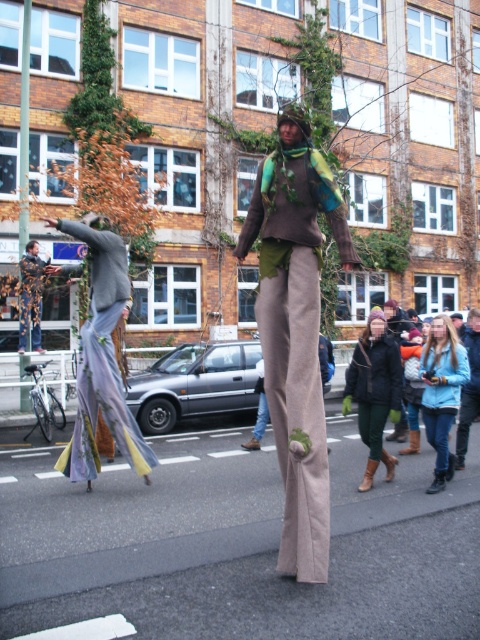
You are a photographer trying to capture both the blue denim jacket at lower right and the camouflage fabric man at left in a single frame. Based on their sizes, which object should you focus on first to ensure both fit in the shot?

The blue denim jacket at lower right has a lesser width compared to the camouflage fabric man at left, so you should focus on the camouflage fabric man at left first to ensure both fit in the shot since it is wider and requires more space.

You are a photographer trying to capture the dark brown leather boots at center and the matte brown pants at center in a single photo. Since both are in the center, will the boots be visible in the photo?

The dark brown leather boots at center is positioned over matte brown pants at center, so yes, the boots will be visible in the photo as they are layered on top of the pants.

You are a photographer trying to capture a photo of the dark brown leather boots at center and matte brown pants at center in the same frame. Based on their positions, which object should you focus on first to ensure both are in the shot?

Since the dark brown leather boots at center are to the left of matte brown pants at center, you should focus on the dark brown leather boots at center first to ensure both are in the shot.